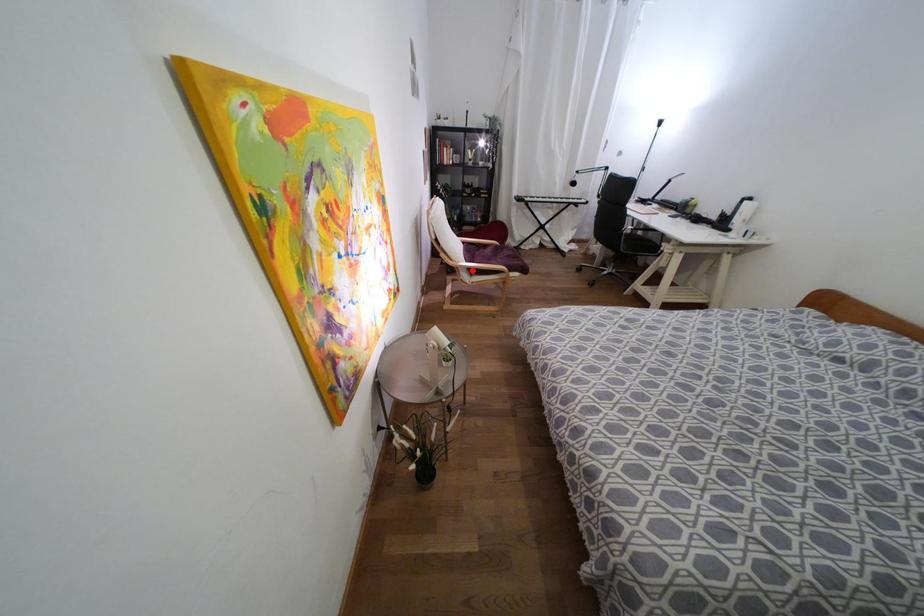
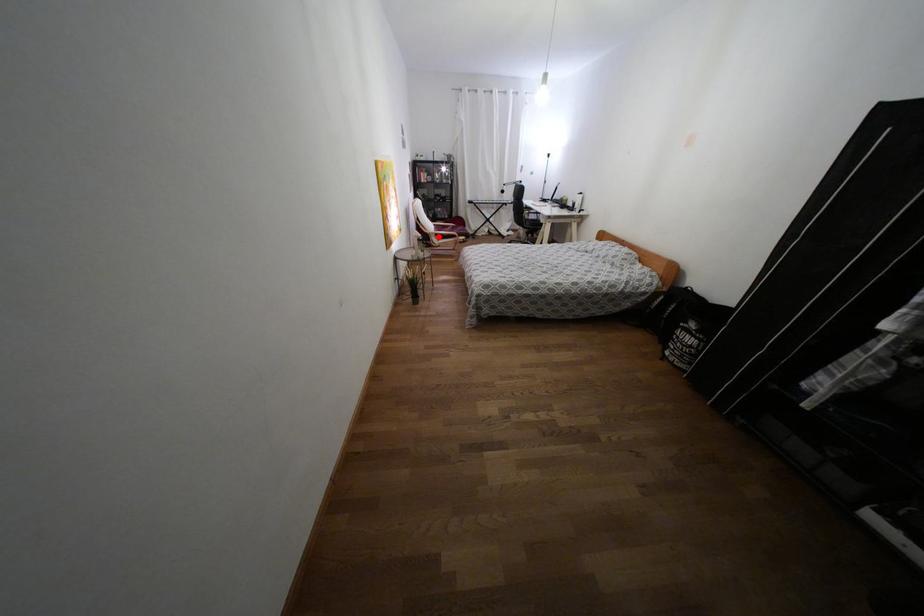
I am providing you with two images of the same scene from different viewpoints. A red point is marked on the first image and another point is marked on the second image. Do the highlighted points in image1 and image2 indicate the same real-world spot?

Yes